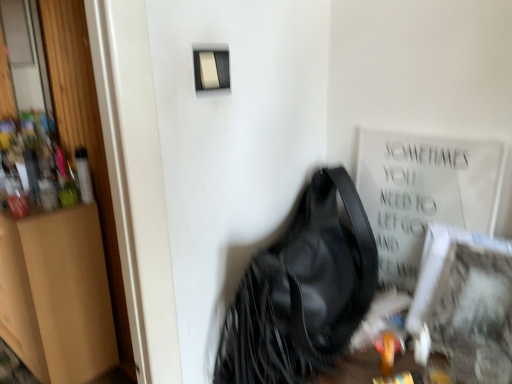
Question: Visually, is brown cardboard dresser at left positioned to the left or to the right of black leather handbag at center?

Choices:
 (A) right
 (B) left

Answer: (B)

Question: Is brown cardboard dresser at left taller or shorter than black leather handbag at center?

Choices:
 (A) tall
 (B) short

Answer: (A)

Question: Considering the real-world distances, which object is closest to the brown cardboard dresser at left?

Choices:
 (A) matte plastic light switch at upper center
 (B) black leather handbag at center
 (C) white textured frame at lower right

Answer: (B)

Question: Estimate the real-world distances between objects in this image. Which object is closer to the matte plastic light switch at upper center?

Choices:
 (A) white textured frame at lower right
 (B) brown cardboard dresser at left
 (C) black leather handbag at center

Answer: (C)